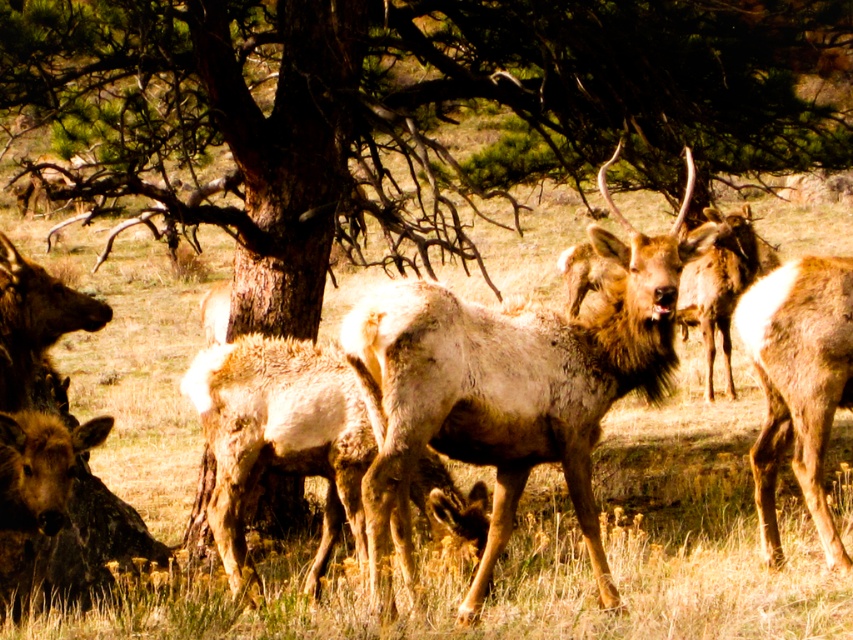
Question: Which point is closer to the camera taking this photo?

Choices:
 (A) (796, 412)
 (B) (285, 628)

Answer: (B)

Question: Does brown fuzzy deer at center appear under brown fur coat at right?

Choices:
 (A) yes
 (B) no

Answer: (B)

Question: Which object appears farthest from the camera in this image?

Choices:
 (A) dry grass at lower left
 (B) brown fur coat at right

Answer: (A)

Question: Which of the following is the closest to the observer?

Choices:
 (A) (403, 426)
 (B) (846, 289)
 (C) (721, 595)

Answer: (A)

Question: Does dry grass at lower left have a greater width compared to brown fuzzy deer at center?

Choices:
 (A) no
 (B) yes

Answer: (A)

Question: Is brown fuzzy deer at center below brown fur coat at right?

Choices:
 (A) yes
 (B) no

Answer: (B)